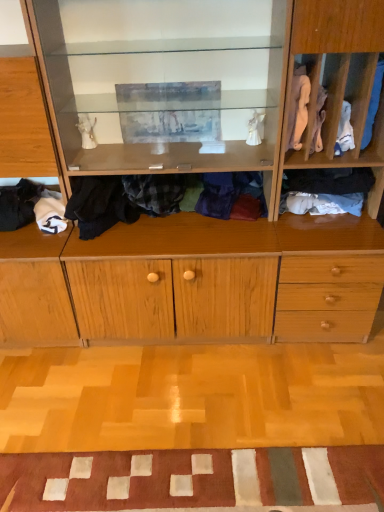
Locate an element on the screen. The height and width of the screenshot is (512, 384). vacant region above white cotton socks at right, which is the fifth clothing in left-to-right order (from a real-world perspective) is located at coordinates pyautogui.click(x=332, y=192).